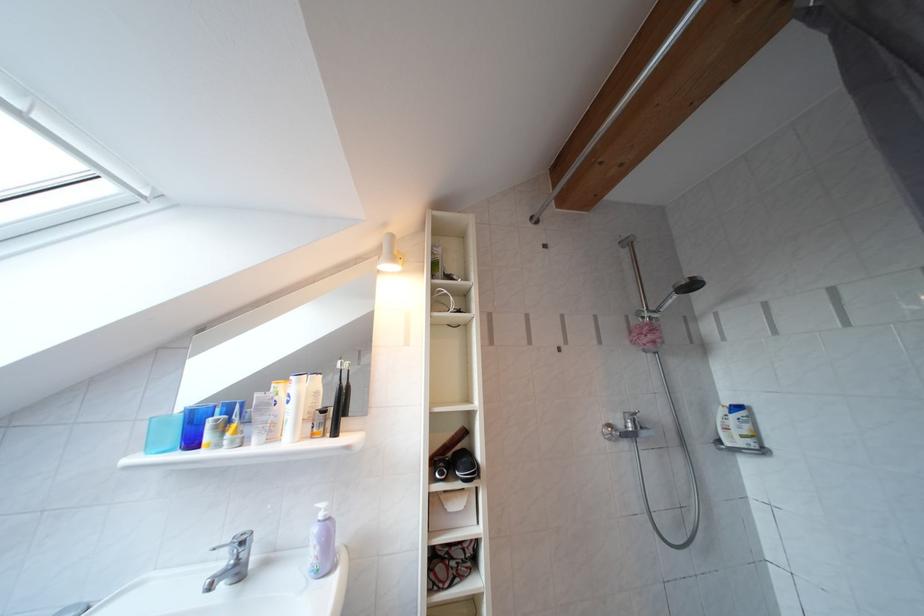
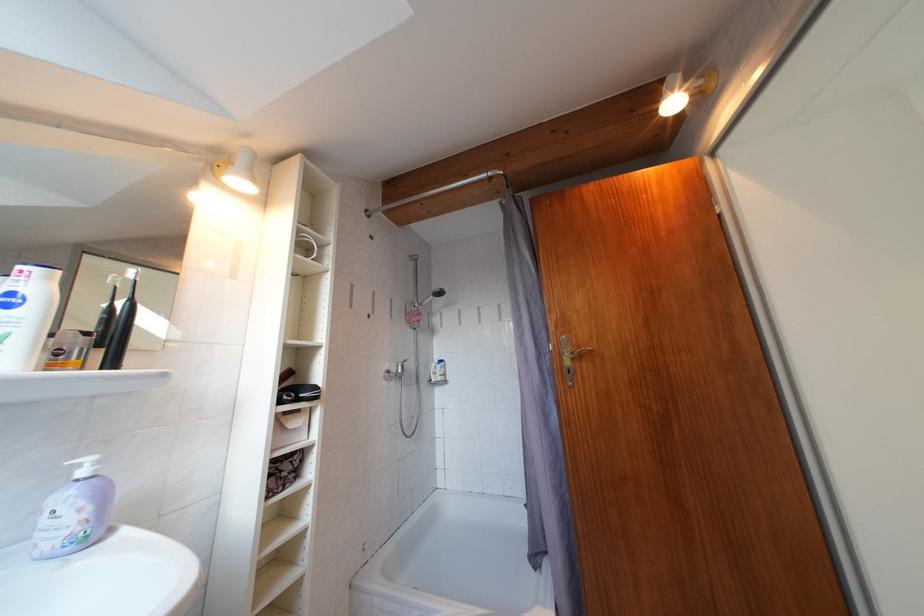
The point at (330,521) is marked in the first image. Where is the corresponding point in the second image?

(92, 477)